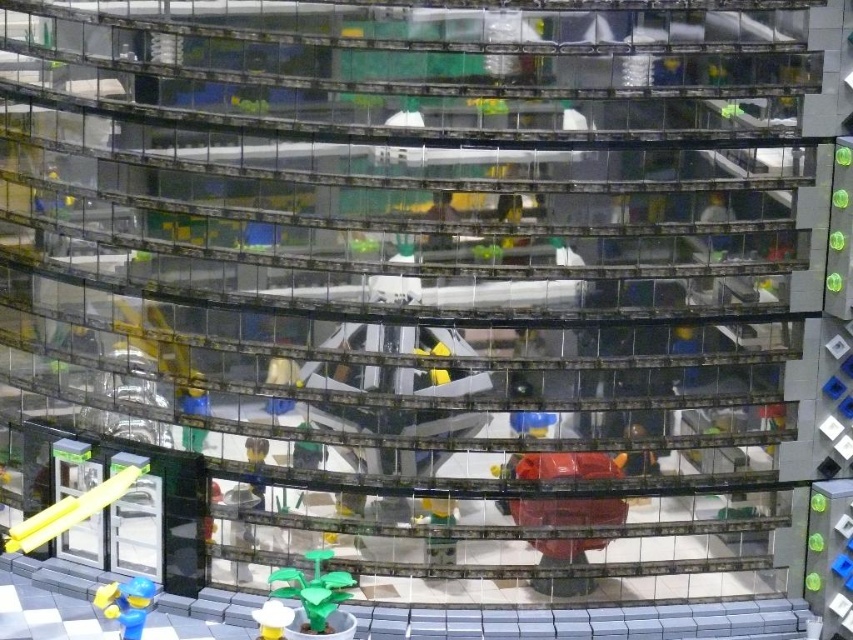
Is blue plastic figure at lower left closer to camera compared to white plastic cup at lower center?

Yes, blue plastic figure at lower left is closer to the viewer.

Can you confirm if blue plastic figure at lower left is taller than white plastic cup at lower center?

Indeed, blue plastic figure at lower left has a greater height compared to white plastic cup at lower center.

Does point (123, 609) lie behind point (268, 620)?

Yes.

At what (x,y) coordinates should I click in order to perform the action: click on blue plastic figure at lower left. Please return your answer as a coordinate pair (x, y). This screenshot has height=640, width=853. Looking at the image, I should click on (126, 604).

Does green matte plant at lower center have a greater height compared to smooth plastic cup at center?

No.

From the picture: Can you confirm if green matte plant at lower center is shorter than smooth plastic cup at center?

Correct, green matte plant at lower center is not as tall as smooth plastic cup at center.

Locate an element on the screen. The image size is (853, 640). green matte plant at lower center is located at coordinates (314, 588).

Is smooth plastic cup at center taller than white plastic cup at lower center?

Indeed, smooth plastic cup at center has a greater height compared to white plastic cup at lower center.

Who is more forward, [447,560] or [279,618]?

Point [279,618] is more forward.

I want to click on smooth plastic cup at center, so click(438, 509).